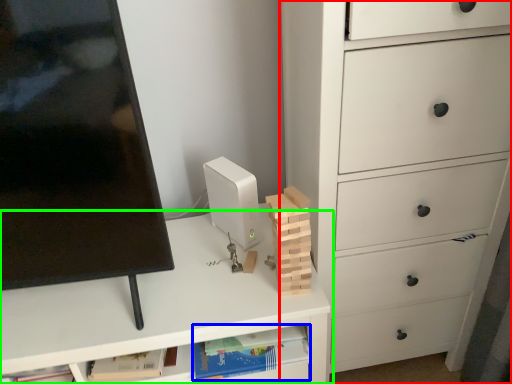
Question: Considering the real-world distances, which object is closest to chest of drawers (highlighted by a red box)? book (highlighted by a blue box) or desk (highlighted by a green box).

Choices:
 (A) book
 (B) desk

Answer: (B)